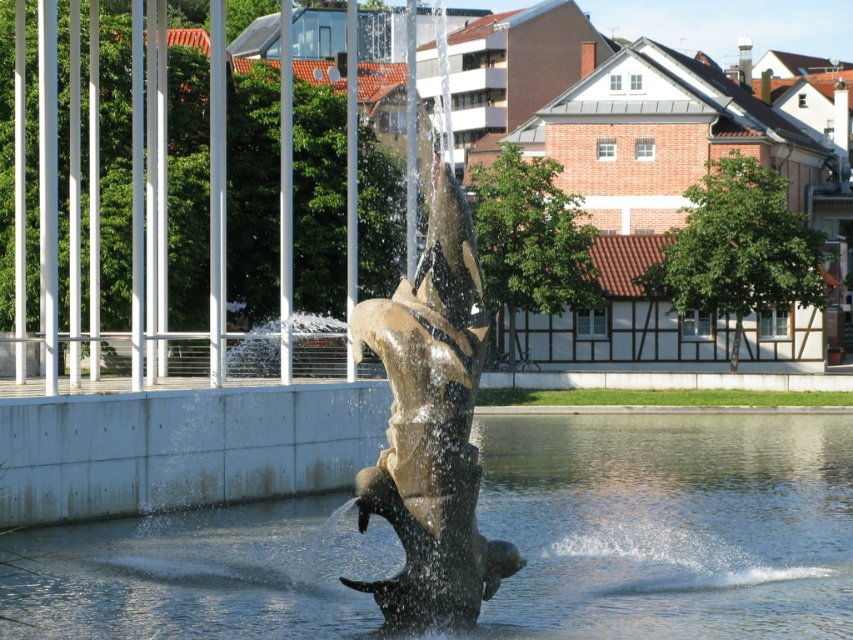
Question: Which object appears closest to the camera in this image?

Choices:
 (A) gold polished metal fish at center
 (B) clear water at center

Answer: (A)

Question: Is clear water at center positioned before gold polished metal fish at center?

Choices:
 (A) yes
 (B) no

Answer: (B)

Question: From the image, what is the correct spatial relationship of clear water at center in relation to gold polished metal fish at center?

Choices:
 (A) left
 (B) right

Answer: (B)

Question: Can you confirm if clear water at center is positioned above gold polished metal fish at center?

Choices:
 (A) no
 (B) yes

Answer: (A)